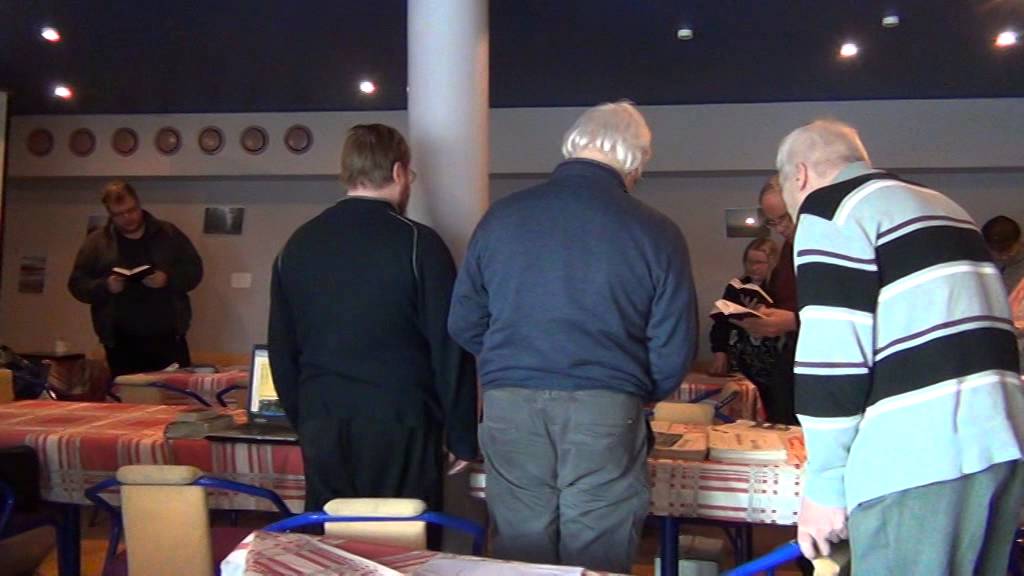
Where is `books stacked`? books stacked is located at coordinates (187, 431), (194, 419).